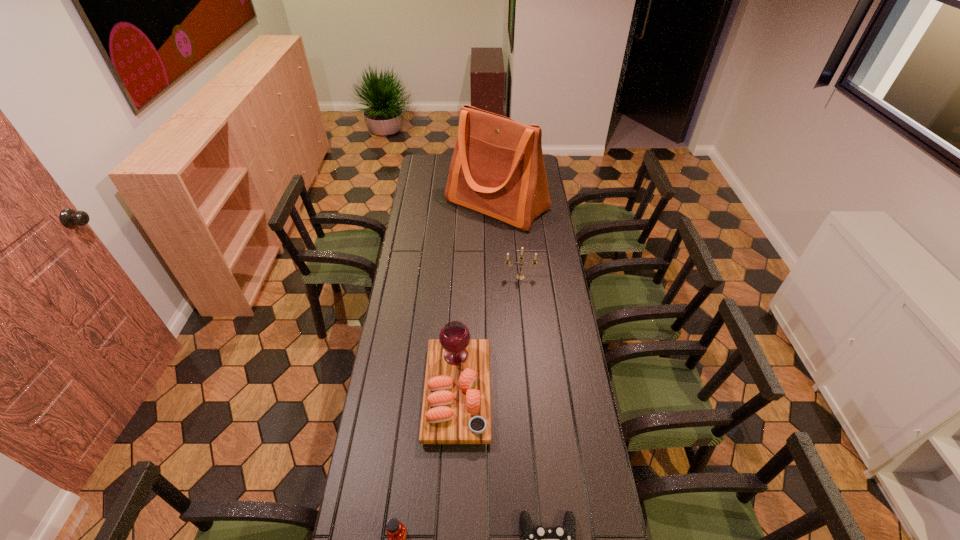
In the image, there is a desktop. What are the coordinates of `free space at the right edge` in the screenshot? It's located at (561, 434).

At what (x,y) coordinates should I click in order to perform the action: click on vacant point at the far left corner. Please return your answer as a coordinate pair (x, y). Looking at the image, I should click on (429, 158).

This screenshot has width=960, height=540. What are the coordinates of `blank region between the platter and the candle` in the screenshot? It's located at (489, 335).

Locate an element on the screen. This screenshot has width=960, height=540. vacant space in between the platter and the tallest object is located at coordinates (477, 299).

This screenshot has width=960, height=540. In order to click on unoccupied area between the candle and the shopping bag in this screenshot , I will do `click(509, 241)`.

Identify the location of free area in between the fourth nearest object and the third nearest object. (489, 335).

Identify the location of vacant point located between the second farthest object and the shopping bag. The image size is (960, 540). (509, 241).

Identify which object is the third nearest to the tallest object. Please provide its 2D coordinates. Your answer should be formatted as a tuple, i.e. [(x, y)], where the tuple contains the x and y coordinates of a point satisfying the conditions above.

[(560, 539)]

Identify the location of the third closest object to the third nearest object. (519, 276).